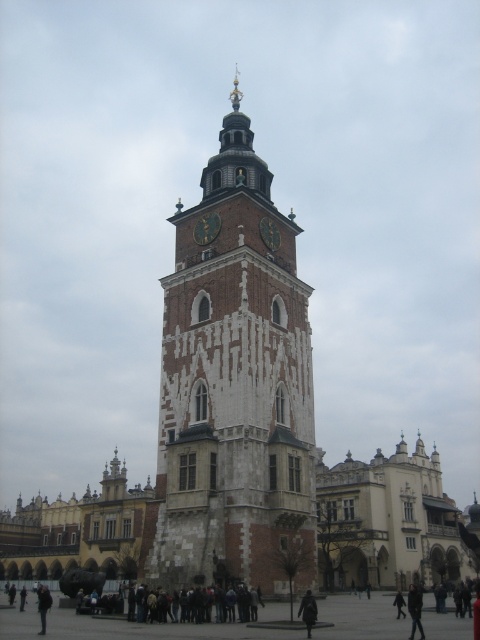
Question: Among these objects, which one is farthest from the camera?

Choices:
 (A) brown stone clock tower at center
 (B) black leather jacket at lower left

Answer: (A)

Question: Which object is the closest to the dark gray fabric coat at center?

Choices:
 (A) gold metallic clock at center
 (B) black leather jacket at lower left
 (C) dark gray jacket at lower center

Answer: (C)

Question: Where is brown stone clock tower at center located in relation to dark brown wooden clock at center in the image?

Choices:
 (A) below
 (B) above

Answer: (B)

Question: Is brown stone clock tower at center bigger than gold metallic clock at center?

Choices:
 (A) yes
 (B) no

Answer: (A)

Question: Is dark brown wooden clock at center to the right of dark gray fabric coat at center from the viewer's perspective?

Choices:
 (A) no
 (B) yes

Answer: (A)

Question: Which of the following is the closest to the observer?

Choices:
 (A) (309, 596)
 (B) (212, 220)

Answer: (A)